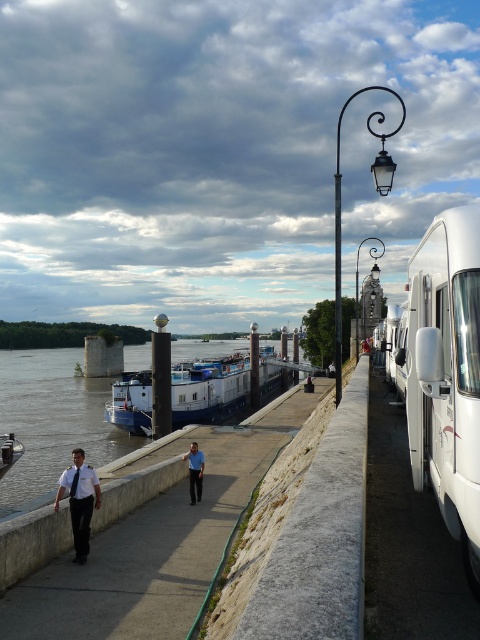
Does concrete sidewalk at center have a smaller size compared to light blue uniform at center?

Incorrect, concrete sidewalk at center is not smaller in size than light blue uniform at center.

Is point (50, 604) behind point (120, 483)?

No, (50, 604) is in front of (120, 483).

The height and width of the screenshot is (640, 480). In order to click on concrete sidewalk at center in this screenshot , I will do `click(156, 545)`.

Between point (255, 433) and point (190, 387), which one is positioned in front?

Point (255, 433)

Is concrete sidewalk at center positioned before blue matte barge at center?

Yes, concrete sidewalk at center is closer to the viewer.

Who is more distant from viewer, (275, 408) or (244, 372)?

Point (244, 372)

You are a GUI agent. You are given a task and a screenshot of the screen. Output one action in this format:
    pyautogui.click(x=<x>, y=<y>)
    Task: Click on the concrete sidewalk at center
    The width and height of the screenshot is (480, 640).
    Given the screenshot: What is the action you would take?
    pyautogui.click(x=156, y=545)

Is white glossy recreational vehicle at right to the left of light blue uniform at center from the viewer's perspective?

Incorrect, white glossy recreational vehicle at right is not on the left side of light blue uniform at center.

Find the location of a particular element. This screenshot has width=480, height=640. white glossy recreational vehicle at right is located at coordinates (445, 374).